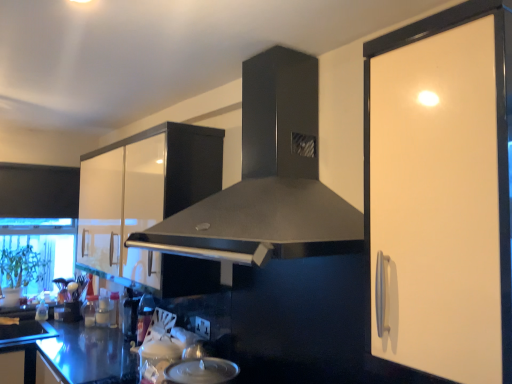
Describe the element at coordinates (72, 311) in the screenshot. I see `matte black knife block at lower left, arranged as the first appliance when viewed from the left` at that location.

Find the location of a particular element. This screenshot has width=512, height=384. white glossy cabinet handle at right is located at coordinates (441, 193).

Locate an element on the screen. Image resolution: width=512 pixels, height=384 pixels. matte black range hood at center is located at coordinates (267, 180).

In order to face transparent glass window screen at lower left, should I rotate leftwards or rightwards?

It's best to rotate left around 26.402 degrees.

What do you see at coordinates (150, 202) in the screenshot?
I see `glossy white cabinet at upper left` at bounding box center [150, 202].

Identify the location of shiny metallic bottle at lower left, the 1th appliance in the right-to-left sequence. (144, 316).

At what (x,y) coordinates should I click in order to perform the action: click on cabinetry on the left of the shiny metallic bottle at lower left, which is the 2th appliance from left to right. Please return your answer as a coordinate pair (x, y). Image resolution: width=512 pixels, height=384 pixels. Looking at the image, I should click on (150, 202).

From the picture: Is glossy white cabinet at upper left to the right of shiny metallic bottle at lower left, which is the 2th appliance from left to right, from the viewer's perspective?

No, glossy white cabinet at upper left is not to the right of shiny metallic bottle at lower left, which is the 2th appliance from left to right.

Which is behind, point (140, 167) or point (144, 315)?

The point (144, 315) is farther.

Based on the photo, is glossy white cabinet at upper left inside the boundaries of shiny metallic bottle at lower left, the 1th appliance in the right-to-left sequence, or outside?

The correct answer is: outside.

Is matte black knife block at lower left, arranged as the first appliance when viewed from the left, taller or shorter than shiny metallic bottle at lower left, which is the first appliance in front-to-back order?

Clearly, matte black knife block at lower left, arranged as the first appliance when viewed from the left, is shorter compared to shiny metallic bottle at lower left, which is the first appliance in front-to-back order.

Can you confirm if matte black knife block at lower left, arranged as the first appliance when viewed from the left, is smaller than shiny metallic bottle at lower left, which is the first appliance in front-to-back order?

Yes, matte black knife block at lower left, arranged as the first appliance when viewed from the left, is smaller than shiny metallic bottle at lower left, which is the first appliance in front-to-back order.

Does matte black knife block at lower left, arranged as the second appliance when viewed from the front, touch shiny metallic bottle at lower left, which is the first appliance in front-to-back order?

No, matte black knife block at lower left, arranged as the second appliance when viewed from the front, is not beside shiny metallic bottle at lower left, which is the first appliance in front-to-back order.

How far apart are transparent glass window screen at lower left and glossy white cabinet at upper left?

The distance of transparent glass window screen at lower left from glossy white cabinet at upper left is 3.90 feet.

In the scene shown: Is transparent glass window screen at lower left turned away from glossy white cabinet at upper left?

No, transparent glass window screen at lower left is not facing the opposite direction of glossy white cabinet at upper left.

From a real-world perspective, is transparent glass window screen at lower left positioned above or below glossy white cabinet at upper left?

Clearly, from a real-world perspective, transparent glass window screen at lower left is below glossy white cabinet at upper left.

Considering the sizes of objects shiny metallic bottle at lower left, the 1th appliance in the right-to-left sequence, and white glossy cabinet handle at right in the image provided, who is bigger, shiny metallic bottle at lower left, the 1th appliance in the right-to-left sequence, or white glossy cabinet handle at right?

white glossy cabinet handle at right is bigger.

In the scene shown: Who is taller, shiny metallic bottle at lower left, marked as the second appliance in a back-to-front arrangement, or white glossy cabinet handle at right?

white glossy cabinet handle at right is taller.

From a real-world perspective, which appliance is the 1st one underneath the white glossy cabinet handle at right? Please provide its 2D coordinates.

[(144, 316)]

How different are the orientations of shiny metallic bottle at lower left, marked as the second appliance in a back-to-front arrangement, and white glossy cabinet handle at right in degrees?

The facing directions of shiny metallic bottle at lower left, marked as the second appliance in a back-to-front arrangement, and white glossy cabinet handle at right are 1.27 degrees apart.

Is satin silver lid at lower center in front of or behind matte black knife block at lower left, arranged as the second appliance when viewed from the front, in the image?

satin silver lid at lower center is positioned closer to the viewer than matte black knife block at lower left, arranged as the second appliance when viewed from the front.

Can you confirm if satin silver lid at lower center is wider than matte black knife block at lower left, arranged as the first appliance when viewed from the left?

Yes, satin silver lid at lower center is wider than matte black knife block at lower left, arranged as the first appliance when viewed from the left.

In the scene shown: From a real-world perspective, does satin silver lid at lower center stand above matte black knife block at lower left, arranged as the second appliance when viewed from the front?

Yes.

Which is behind, point (216, 361) or point (65, 305)?

The point (65, 305) is more distant.

Is matte black knife block at lower left, the second appliance positioned from the right, positioned far away from transparent glass window screen at lower left?

They are positioned close to each other.

Is matte black knife block at lower left, arranged as the second appliance when viewed from the front, bigger than transparent glass window screen at lower left?

Incorrect, matte black knife block at lower left, arranged as the second appliance when viewed from the front, is not larger than transparent glass window screen at lower left.

Is point (67, 304) farther from viewer compared to point (65, 247)?

That is False.

Looking at their sizes, would you say matte black knife block at lower left, arranged as the second appliance when viewed from the front, is wider or thinner than transparent glass window screen at lower left?

In the image, matte black knife block at lower left, arranged as the second appliance when viewed from the front, appears to be more narrow than transparent glass window screen at lower left.

Is white glossy cabinet handle at right positioned with its back to glossy white cabinet at upper left?

No, white glossy cabinet handle at right's orientation is not away from glossy white cabinet at upper left.

From the image's perspective, between white glossy cabinet handle at right and glossy white cabinet at upper left, who is located below?

glossy white cabinet at upper left, from the image's perspective.

Is white glossy cabinet handle at right wider than glossy white cabinet at upper left?

Incorrect, the width of white glossy cabinet handle at right does not surpass that of glossy white cabinet at upper left.

Between white glossy cabinet handle at right and glossy white cabinet at upper left, which one appears on the right side from the viewer's perspective?

From the viewer's perspective, white glossy cabinet handle at right appears more on the right side.

Where is `the 1st appliance behind the glossy white cabinet at upper left`? This screenshot has height=384, width=512. the 1st appliance behind the glossy white cabinet at upper left is located at coordinates (144, 316).

Where is `appliance in front of the matte black knife block at lower left, the second appliance positioned from the right`? The height and width of the screenshot is (384, 512). appliance in front of the matte black knife block at lower left, the second appliance positioned from the right is located at coordinates (144, 316).

Which object lies further to the anchor point satin silver lid at lower center, glossy white cabinet at upper left or transparent glass window screen at lower left?

The object further to satin silver lid at lower center is transparent glass window screen at lower left.

Based on their spatial positions, is matte black knife block at lower left, arranged as the second appliance when viewed from the front, or shiny metallic bottle at lower left, which is the first appliance in front-to-back order, closer to white glossy cabinet handle at right?

shiny metallic bottle at lower left, which is the first appliance in front-to-back order, is positioned closer to the anchor white glossy cabinet handle at right.

When comparing their distances from matte black range hood at center, does glossy white cabinet at upper left or transparent glass window screen at lower left seem further?

Based on the image, transparent glass window screen at lower left appears to be further to matte black range hood at center.

Considering their positions, is glossy white cabinet at upper left positioned closer to white glossy cabinet handle at right than shiny metallic bottle at lower left, which is the first appliance in front-to-back order?

Among the two, glossy white cabinet at upper left is located nearer to white glossy cabinet handle at right.

When comparing their distances from satin silver lid at lower center, does white glossy cabinet handle at right or transparent glass window screen at lower left seem closer?

Based on the image, white glossy cabinet handle at right appears to be nearer to satin silver lid at lower center.

Which object lies further to the anchor point transparent glass window screen at lower left, matte black knife block at lower left, arranged as the second appliance when viewed from the front, or shiny metallic bottle at lower left, which is the first appliance in front-to-back order?

Among the two, shiny metallic bottle at lower left, which is the first appliance in front-to-back order, is located further to transparent glass window screen at lower left.

Considering their positions, is transparent glass window screen at lower left positioned further to satin silver lid at lower center than white glossy cabinet handle at right?

The object further to satin silver lid at lower center is transparent glass window screen at lower left.

When comparing their distances from white glossy cabinet handle at right, does transparent glass window screen at lower left or glossy white cabinet at upper left seem closer?

Based on the image, glossy white cabinet at upper left appears to be nearer to white glossy cabinet handle at right.

Locate an element on the screen. home appliance located between white glossy cabinet handle at right and transparent glass window screen at lower left in the depth direction is located at coordinates (267, 180).

Identify the location of cabinetry between white glossy cabinet handle at right and transparent glass window screen at lower left along the z-axis. The width and height of the screenshot is (512, 384). (150, 202).

Locate an element on the screen. kitchen appliance between white glossy cabinet handle at right and glossy white cabinet at upper left from front to back is located at coordinates (201, 371).

I want to click on window screen located between matte black range hood at center and matte black knife block at lower left, arranged as the 1th appliance when viewed from the back, in the depth direction, so click(x=36, y=252).